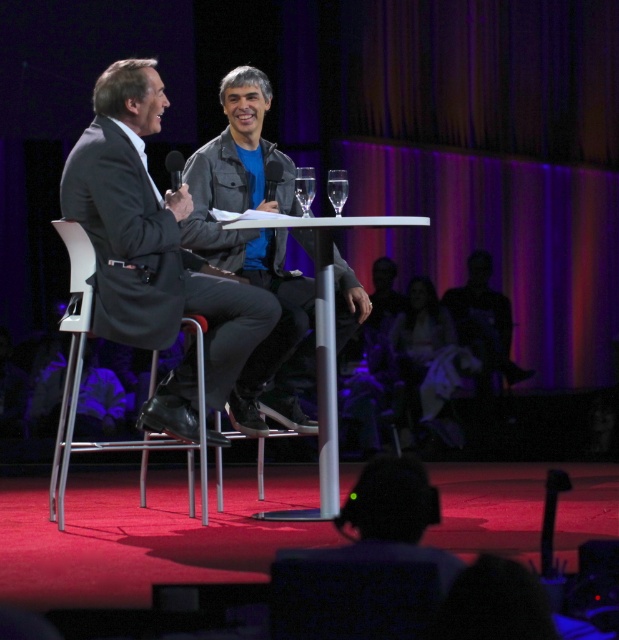
Question: Estimate the real-world distances between objects in this image. Which object is farther from the dark gray suit at center?

Choices:
 (A) transparent glass at center
 (B) white plastic chair at left
 (C) white glossy table at center
 (D) gray leather jacket at center

Answer: (A)

Question: Among these points, which one is farthest from the camera?

Choices:
 (A) (327, 180)
 (B) (288, 221)
 (C) (308, 348)
 (D) (111, 150)

Answer: (C)

Question: Can you confirm if white plastic chair at left is positioned to the right of clear glass at center?

Choices:
 (A) no
 (B) yes

Answer: (A)

Question: Considering the relative positions of dark gray suit at center and white glossy table at center in the image provided, where is dark gray suit at center located with respect to white glossy table at center?

Choices:
 (A) right
 (B) left

Answer: (B)

Question: Can you confirm if dark gray suit at center is smaller than clear glass at center?

Choices:
 (A) yes
 (B) no

Answer: (B)

Question: Which object is closer to the camera taking this photo?

Choices:
 (A) white glossy table at center
 (B) clear glass at center
 (C) gray leather jacket at center

Answer: (A)